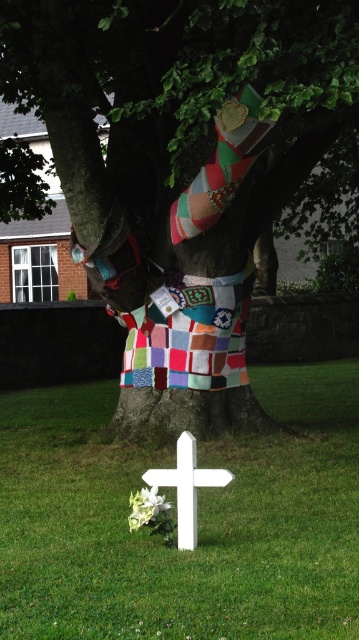
You are standing in front of the tree and want to place a new crocheted piece on the trunk. However, you need to step over the cross to reach the trunk. Is the path clear between the white matte cross at lower center and the patchwork quilted tree trunk at center?

The patchwork quilted tree trunk at center is further to the viewer than the white matte cross at lower center, so stepping over the cross would allow you to reach the trunk as the path is clear between them.

You are standing in front of the tree and want to place a new crocheted piece on the patchwork quilted tree trunk at center. However, you notice another patchwork quilt at upper center. Which one is closer to you?

The patchwork quilted tree trunk at center is closer to you because it is in front of the patchwork quilt at upper center.

You are an artist planning to paint the scene of the patchwork quilted tree trunk at center and the patchwork quilt at upper center. Which object should you paint first if you want to follow the rule of painting from the tallest to the shortest?

The patchwork quilt at upper center should be painted first because it is taller than the patchwork quilted tree trunk at center.